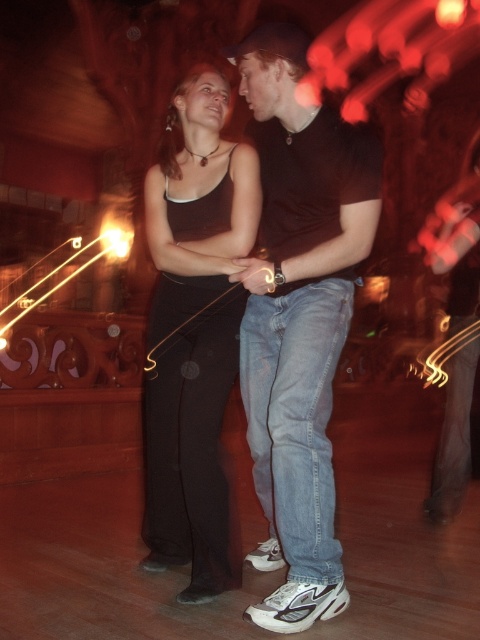
Is point (330, 280) positioned in front of point (211, 228)?

Yes, it is.

Is point (343, 128) farther from viewer compared to point (214, 99)?

No, it is not.

Image resolution: width=480 pixels, height=640 pixels. I want to click on denim jeans at center, so click(299, 317).